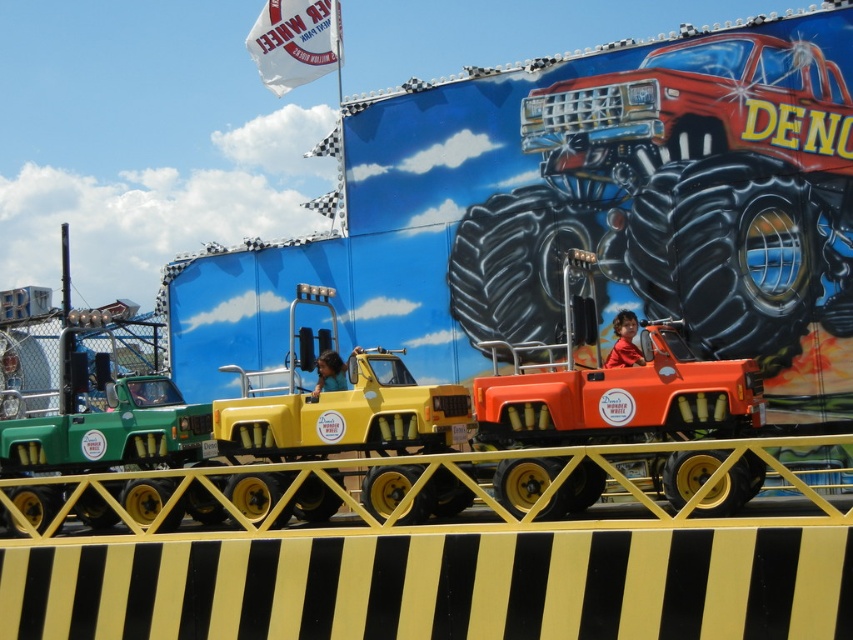
Question: Which point is farther from the camera taking this photo?

Choices:
 (A) (664, 385)
 (B) (370, 404)

Answer: (B)

Question: Can you confirm if orange matte toy truck at center is positioned above yellow matte truck at center?

Choices:
 (A) no
 (B) yes

Answer: (A)

Question: Observing the image, what is the correct spatial positioning of orange matte toy truck at center in reference to yellow matte truck at center?

Choices:
 (A) below
 (B) above

Answer: (A)

Question: Observing the image, what is the correct spatial positioning of orange matte toy truck at center in reference to yellow matte truck at center?

Choices:
 (A) below
 (B) above

Answer: (A)